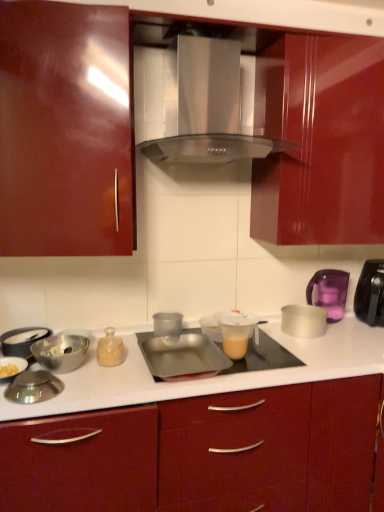
This screenshot has height=512, width=384. What are the coordinates of `free spot to the right of translucent plastic measuring cup at center, the seventh appliance in the left-to-right sequence` in the screenshot? It's located at (294, 360).